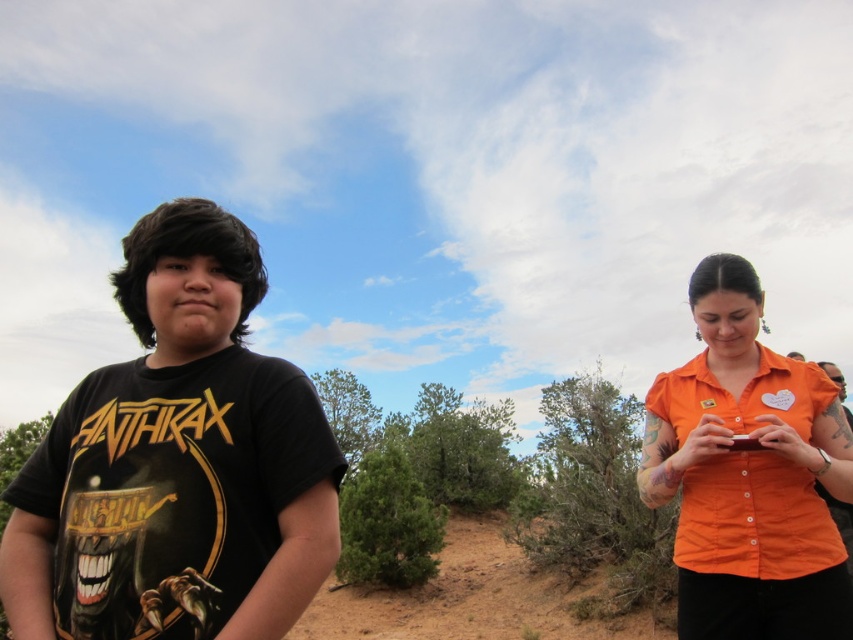
Can you confirm if black matte t-shirt at left is positioned below orange button-down shirt at right?

No.

Is black matte t-shirt at left positioned in front of orange button-down shirt at right?

Yes.

Which is behind, point (113, 570) or point (699, 474)?

Positioned behind is point (699, 474).

Identify the location of black matte t-shirt at left. (177, 461).

Can you confirm if black matte t-shirt at left is bigger than brown sandy dirt track at center?

Correct, black matte t-shirt at left is larger in size than brown sandy dirt track at center.

Does black matte t-shirt at left come behind brown sandy dirt track at center?

No, it is in front of brown sandy dirt track at center.

Who is more forward, (289, 420) or (469, 588)?

Point (289, 420) is more forward.

In order to click on black matte t-shirt at left in this screenshot , I will do `click(177, 461)`.

Between orange button-down shirt at right and brown sandy dirt track at center, which one appears on the left side from the viewer's perspective?

From the viewer's perspective, brown sandy dirt track at center appears more on the left side.

Is orange button-down shirt at right taller than brown sandy dirt track at center?

Yes.

Which is behind, point (788, 577) or point (584, 621)?

Positioned behind is point (584, 621).

Locate an element on the screen. This screenshot has width=853, height=640. orange button-down shirt at right is located at coordinates (747, 474).